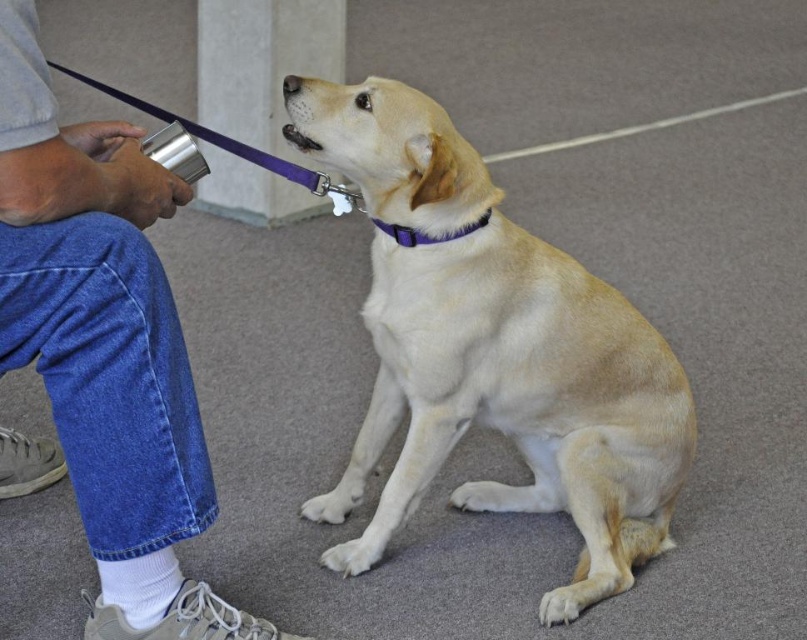
Question: Does brushed metal cup at left appear on the left side of purple fabric collar at upper center?

Choices:
 (A) no
 (B) yes

Answer: (B)

Question: Which object is farther from the camera taking this photo?

Choices:
 (A) purple fabric collar at upper center
 (B) brushed metal cup at left

Answer: (A)

Question: Does brushed metal cup at left have a larger size compared to purple fabric collar at upper center?

Choices:
 (A) no
 (B) yes

Answer: (B)

Question: Where is brushed metal cup at left located in relation to purple fabric collar at upper center in the image?

Choices:
 (A) right
 (B) left

Answer: (B)

Question: Based on their relative distances, which object is nearer to the purple fabric collar at upper center?

Choices:
 (A) light brown fur at center
 (B) brushed metal cup at left

Answer: (A)

Question: Which of these objects is positioned closest to the brushed metal cup at left?

Choices:
 (A) purple fabric collar at upper center
 (B) light brown fur at center

Answer: (B)